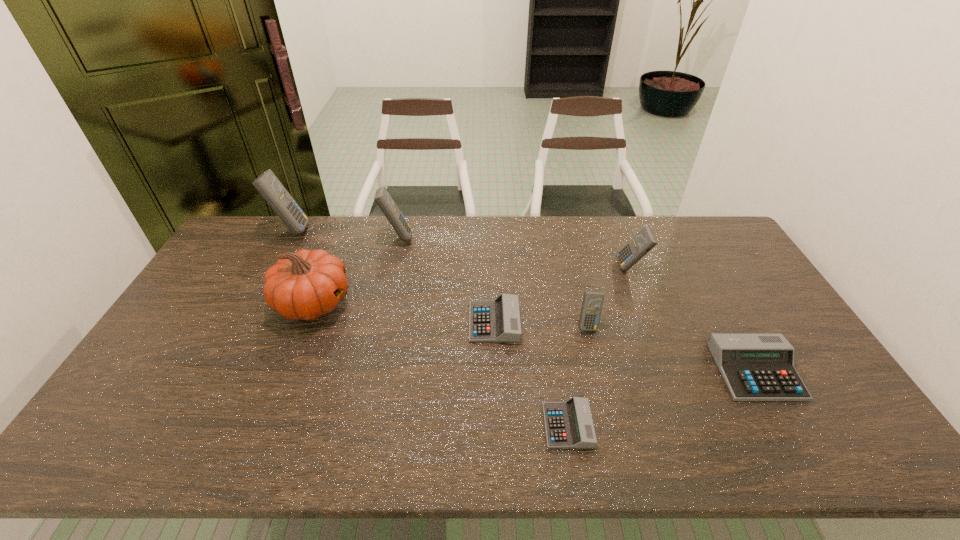
Select which gray calculator appears as the second closest to the rightmost blue calculator. Please provide its 2D coordinates. Your answer should be formatted as a tuple, i.e. [(x, y)], where the tuple contains the x and y coordinates of a point satisfying the conditions above.

[(498, 320)]

Choose which gray calculator is the nearest neighbor to the third blue calculator from right to left. Please provide its 2D coordinates. Your answer should be formatted as a tuple, i.e. [(x, y)], where the tuple contains the x and y coordinates of a point satisfying the conditions above.

[(498, 320)]

Where is `free point that satisfies the following two spatial constraints: 1. on the front-facing side of the second object from right to left; 2. on the front-facing side of the fifth tallest object`? free point that satisfies the following two spatial constraints: 1. on the front-facing side of the second object from right to left; 2. on the front-facing side of the fifth tallest object is located at coordinates (653, 325).

Locate an element on the screen. This screenshot has height=540, width=960. vacant space that satisfies the following two spatial constraints: 1. on the front-facing side of the fourth object from left to right; 2. on the right side of the second blue calculator from left to right is located at coordinates (377, 322).

The width and height of the screenshot is (960, 540). Find the location of `free region that satisfies the following two spatial constraints: 1. on the front-facing side of the nearest object; 2. on the left side of the third smallest blue calculator`. free region that satisfies the following two spatial constraints: 1. on the front-facing side of the nearest object; 2. on the left side of the third smallest blue calculator is located at coordinates (353, 426).

Identify the location of free space that satisfies the following two spatial constraints: 1. on the front-facing side of the second nearest blue calculator; 2. on the front-facing side of the fourth shortest calculator. The image size is (960, 540). (653, 325).

I want to click on vacant point that satisfies the following two spatial constraints: 1. on the front-facing side of the rightmost blue calculator; 2. on the right side of the third shortest object, so click(x=671, y=371).

At what (x,y) coordinates should I click in order to perform the action: click on free region that satisfies the following two spatial constraints: 1. on the front-facing side of the third blue calculator from right to left; 2. on the left side of the third calculator from left to right. Please return your answer as a coordinate pair (x, y). Image resolution: width=960 pixels, height=540 pixels. Looking at the image, I should click on (377, 322).

Find the location of a particular element. free space that satisfies the following two spatial constraints: 1. on the front-facing side of the second object from right to left; 2. on the front-facing side of the fourth tallest calculator is located at coordinates (653, 325).

Where is `free spot that satisfies the following two spatial constraints: 1. on the front side of the farthest gray calculator; 2. on the right side of the second gray calculator from right to left`? The width and height of the screenshot is (960, 540). free spot that satisfies the following two spatial constraints: 1. on the front side of the farthest gray calculator; 2. on the right side of the second gray calculator from right to left is located at coordinates (497, 426).